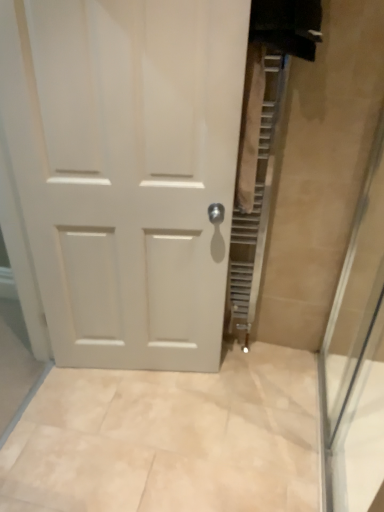
This screenshot has height=512, width=384. In order to click on free region on the left part of transparent glass shower door at right in this screenshot , I will do `click(218, 449)`.